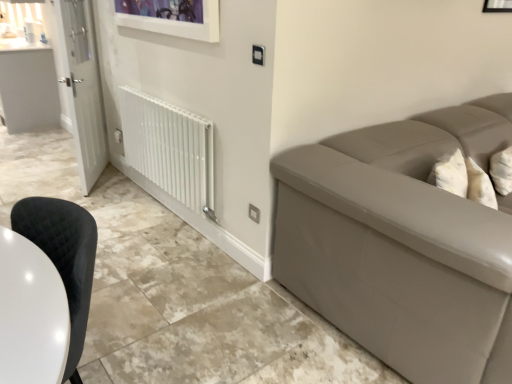
Where is `white glossy door at left`? The width and height of the screenshot is (512, 384). white glossy door at left is located at coordinates (82, 87).

Where is `white glossy counter top at upper left`? Image resolution: width=512 pixels, height=384 pixels. white glossy counter top at upper left is located at coordinates (28, 86).

What do you see at coordinates (63, 253) in the screenshot? I see `black quilted fabric chair at lower left` at bounding box center [63, 253].

In order to face black quilted fabric chair at lower left, should I rotate leftwards or rightwards?

Rotate left and turn 25.916 degrees.

Image resolution: width=512 pixels, height=384 pixels. In order to click on white glossy radiator at lower left in this screenshot , I will do `click(169, 148)`.

Does white glossy radiator at lower left turn towards white glossy counter top at upper left?

No, white glossy radiator at lower left is not facing towards white glossy counter top at upper left.

Is white glossy radiator at lower left wider or thinner than white glossy counter top at upper left?

In the image, white glossy radiator at lower left appears to be more narrow than white glossy counter top at upper left.

Which of these two, white glossy radiator at lower left or white glossy counter top at upper left, stands taller?

white glossy counter top at upper left is taller.

Considering the positions of objects white glossy radiator at lower left and white glossy counter top at upper left in the image provided, who is behind, white glossy radiator at lower left or white glossy counter top at upper left?

white glossy counter top at upper left is further away from the camera.

Between white glossy counter top at upper left and white glossy door at left, which one has more height?

white glossy door at left.

Does point (52, 82) lie in front of point (69, 95)?

That is False.

In order to click on counter top above the white glossy door at left (from the image's perspective) in this screenshot , I will do `click(28, 86)`.

Are white glossy counter top at upper left and white glossy door at left far apart?

That's right, there is a large distance between white glossy counter top at upper left and white glossy door at left.

From their relative heights in the image, would you say black quilted fabric chair at lower left is taller or shorter than white glossy door at left?

Clearly, black quilted fabric chair at lower left is shorter compared to white glossy door at left.

Is black quilted fabric chair at lower left directly adjacent to white glossy door at left?

No, black quilted fabric chair at lower left is not next to white glossy door at left.

Is black quilted fabric chair at lower left inside or outside of white glossy door at left?

black quilted fabric chair at lower left is not inside white glossy door at left, it's outside.

Between black quilted fabric chair at lower left and white glossy door at left, which one is positioned behind?

white glossy door at left is further away from the camera.

Which is more to the left, white glossy door at left or white glossy radiator at lower left?

white glossy door at left.

From a real-world perspective, is white glossy door at left positioned under white glossy radiator at lower left based on gravity?

Incorrect, from a real-world perspective, white glossy door at left is higher than white glossy radiator at lower left.

Does white glossy door at left have a greater height compared to white glossy radiator at lower left?

Indeed, white glossy door at left has a greater height compared to white glossy radiator at lower left.

Can you confirm if white glossy door at left is thinner than white glossy radiator at lower left?

In fact, white glossy door at left might be wider than white glossy radiator at lower left.

Is white glossy radiator at lower left shorter than white glossy door at left?

Yes, white glossy radiator at lower left is shorter than white glossy door at left.

Looking at this image, is white glossy radiator at lower left inside the boundaries of white glossy door at left, or outside?

white glossy radiator at lower left is not enclosed by white glossy door at left.

From a real-world perspective, is white glossy radiator at lower left physically located above or below white glossy door at left?

From a real-world perspective, white glossy radiator at lower left is physically below white glossy door at left.

Does white glossy radiator at lower left have a greater width compared to white glossy door at left?

No, white glossy radiator at lower left is not wider than white glossy door at left.

From the image's perspective, is white glossy radiator at lower left positioned above or below black quilted fabric chair at lower left?

From the image's perspective, white glossy radiator at lower left appears above black quilted fabric chair at lower left.

Is white glossy radiator at lower left taller than black quilted fabric chair at lower left?

No.

Is white glossy radiator at lower left far away from black quilted fabric chair at lower left?

Indeed, white glossy radiator at lower left is not near black quilted fabric chair at lower left.

Where is `radiator above the black quilted fabric chair at lower left (from a real-world perspective)`? radiator above the black quilted fabric chair at lower left (from a real-world perspective) is located at coordinates (169, 148).

From the image's perspective, is black quilted fabric chair at lower left located above white glossy radiator at lower left?

No, from the image's perspective, black quilted fabric chair at lower left is not over white glossy radiator at lower left.

In the scene shown: Considering the sizes of black quilted fabric chair at lower left and white glossy radiator at lower left in the image, is black quilted fabric chair at lower left wider or thinner than white glossy radiator at lower left?

Considering their sizes, black quilted fabric chair at lower left looks broader than white glossy radiator at lower left.

Is black quilted fabric chair at lower left completely or partially outside of white glossy radiator at lower left?

Indeed, black quilted fabric chair at lower left is completely outside white glossy radiator at lower left.

Considering the positions of objects black quilted fabric chair at lower left and white glossy radiator at lower left in the image provided, who is more to the left, black quilted fabric chair at lower left or white glossy radiator at lower left?

From the viewer's perspective, black quilted fabric chair at lower left appears more on the left side.

Locate an element on the screen. The width and height of the screenshot is (512, 384). radiator below the white glossy counter top at upper left (from the image's perspective) is located at coordinates (169, 148).

I want to click on counter top directly beneath the white glossy door at left (from a real-world perspective), so click(x=28, y=86).

From the picture: Looking at the image, which one is located further to white glossy counter top at upper left, black quilted fabric chair at lower left or white glossy radiator at lower left?

The object further to white glossy counter top at upper left is black quilted fabric chair at lower left.

When comparing their distances from black quilted fabric chair at lower left, does white glossy radiator at lower left or white glossy counter top at upper left seem closer?

white glossy radiator at lower left.

Looking at the image, which one is located closer to white glossy door at left, white glossy radiator at lower left or white glossy counter top at upper left?

Based on the image, white glossy radiator at lower left appears to be nearer to white glossy door at left.

Based on their spatial positions, is white glossy radiator at lower left or black quilted fabric chair at lower left closer to white glossy door at left?

Based on the image, white glossy radiator at lower left appears to be nearer to white glossy door at left.

Which object lies further to the anchor point black quilted fabric chair at lower left, white glossy radiator at lower left or white glossy door at left?

white glossy door at left lies further to black quilted fabric chair at lower left than the other object.

When comparing their distances from white glossy radiator at lower left, does black quilted fabric chair at lower left or white glossy counter top at upper left seem further?

white glossy counter top at upper left.

Estimate the real-world distances between objects in this image. Which object is closer to white glossy radiator at lower left, white glossy door at left or black quilted fabric chair at lower left?

white glossy door at left lies closer to white glossy radiator at lower left than the other object.

Based on their spatial positions, is white glossy door at left or black quilted fabric chair at lower left further from white glossy counter top at upper left?

black quilted fabric chair at lower left is positioned further to the anchor white glossy counter top at upper left.

This screenshot has width=512, height=384. In order to click on radiator between black quilted fabric chair at lower left and white glossy door at left from front to back in this screenshot , I will do `click(169, 148)`.

Locate an element on the screen. This screenshot has width=512, height=384. radiator located between black quilted fabric chair at lower left and white glossy counter top at upper left in the depth direction is located at coordinates (169, 148).

Where is `door between black quilted fabric chair at lower left and white glossy counter top at upper left along the z-axis`? The image size is (512, 384). door between black quilted fabric chair at lower left and white glossy counter top at upper left along the z-axis is located at coordinates (82, 87).

I want to click on door between white glossy counter top at upper left and white glossy radiator at lower left, so click(x=82, y=87).